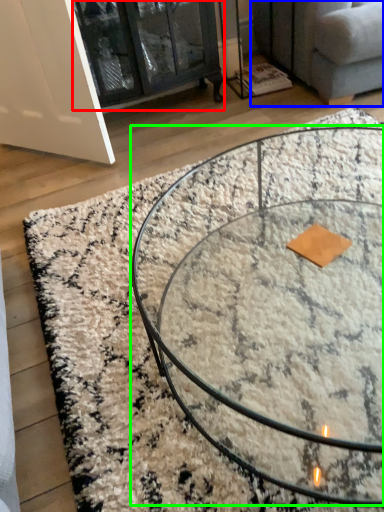
Question: Which is farther away from glass door (highlighted by a red box)? studio couch (highlighted by a blue box) or coffee table (highlighted by a green box)?

Choices:
 (A) studio couch
 (B) coffee table

Answer: (B)